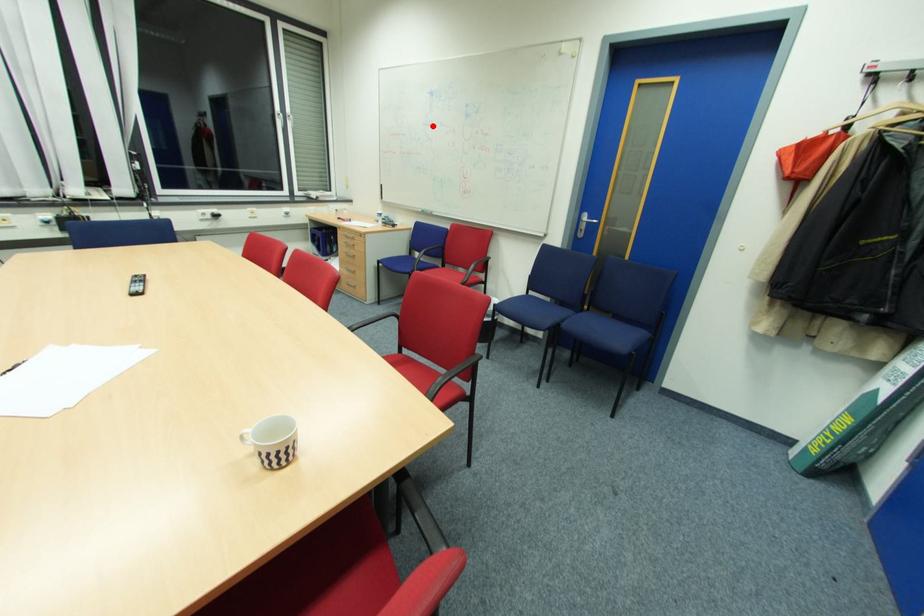
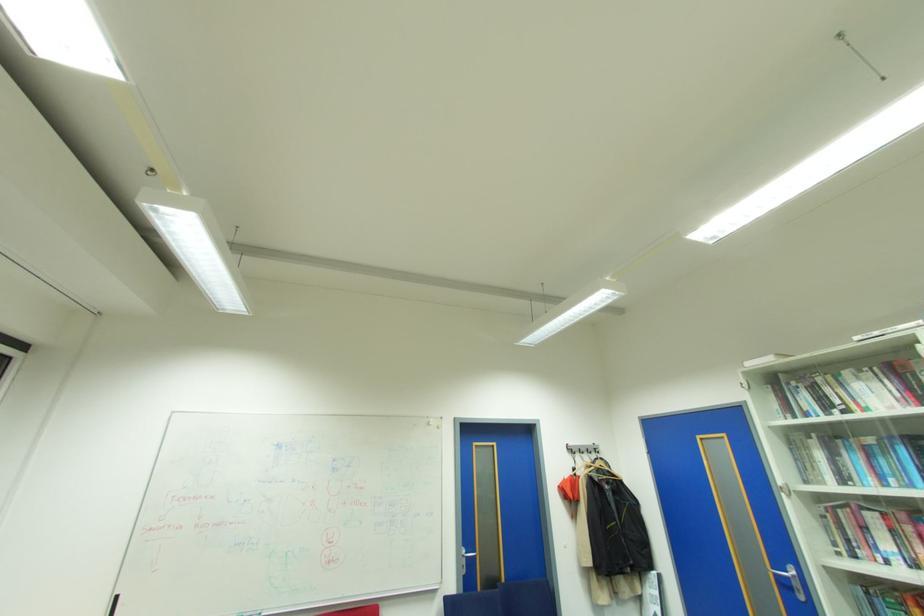
The point at the highlighted location is marked in the first image. Where is the corresponding point in the second image?

(274, 482)